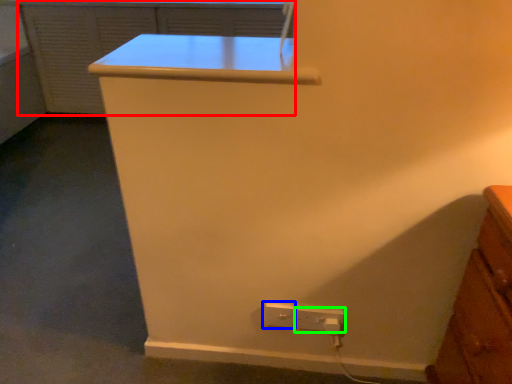
Question: Considering the real-world distances, which object is farthest from file cabinet (highlighted by a red box)? power plugs and sockets (highlighted by a blue box) or power plugs and sockets (highlighted by a green box)?

Choices:
 (A) power plugs and sockets
 (B) power plugs and sockets

Answer: (B)